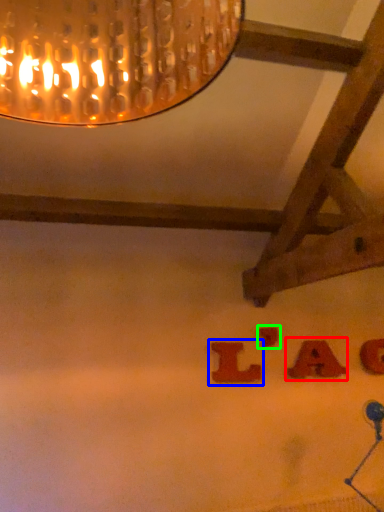
Question: Considering the real-world distances, which object is closest to alphabet (highlighted by a red box)? alphabet (highlighted by a blue box) or alphabet (highlighted by a green box).

Choices:
 (A) alphabet
 (B) alphabet

Answer: (B)